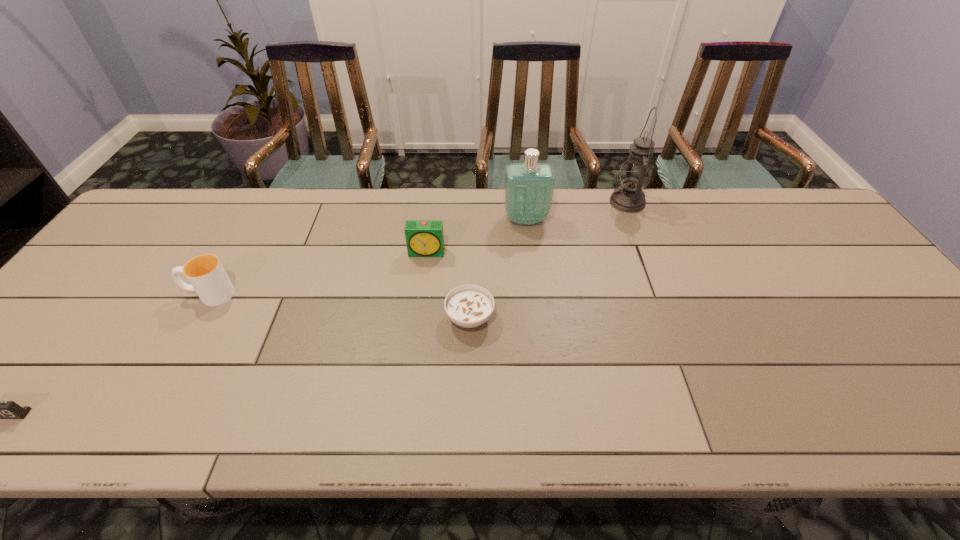
In the image, there is a desktop. Where is `vacant space at the far right corner`? vacant space at the far right corner is located at coordinates (783, 220).

At what (x,y) coordinates should I click in order to perform the action: click on empty location between the fourth object from left to right and the right alarm clock. Please return your answer as a coordinate pair (x, y). Looking at the image, I should click on (448, 285).

Identify the location of vacant point located between the perfume and the second object from left to right. (368, 257).

Locate an element on the screen. empty location between the perfume and the farther alarm clock is located at coordinates (477, 236).

Find the location of a particular element. Image resolution: width=960 pixels, height=540 pixels. unoccupied position between the perfume and the rightmost object is located at coordinates (577, 211).

Where is `unoccupied area between the soup bowl and the fifth object from right to left`? The image size is (960, 540). unoccupied area between the soup bowl and the fifth object from right to left is located at coordinates (340, 306).

Where is `vacant space that's between the second object from left to right and the taller alarm clock`? The height and width of the screenshot is (540, 960). vacant space that's between the second object from left to right and the taller alarm clock is located at coordinates (319, 273).

Image resolution: width=960 pixels, height=540 pixels. Find the location of `unoccupied area between the third object from left to right and the fourth object from left to right`. unoccupied area between the third object from left to right and the fourth object from left to right is located at coordinates (448, 285).

I want to click on object identified as the second closest to the second tallest object, so click(x=635, y=173).

Select which object appears as the fifth closest to the nearer alarm clock. Please provide its 2D coordinates. Your answer should be formatted as a tuple, i.e. [(x, y)], where the tuple contains the x and y coordinates of a point satisfying the conditions above.

[(635, 173)]